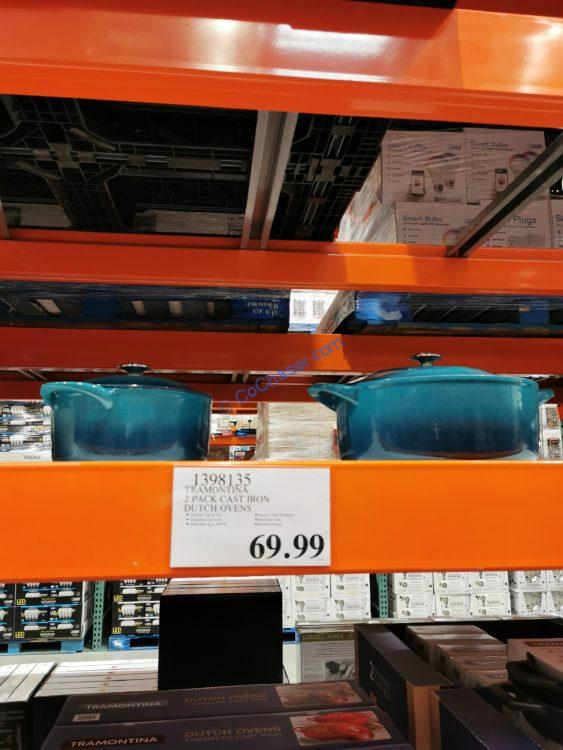
The image size is (563, 750). Identify the location of orange color on shelf edge. (424, 500), (65, 565).